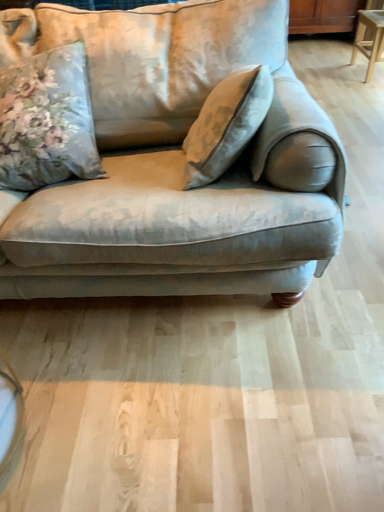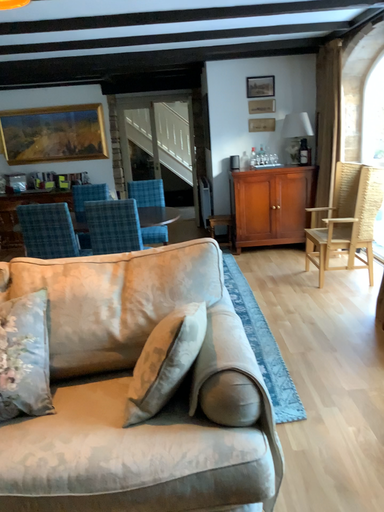
Question: Which way did the camera rotate in the video?

Choices:
 (A) rotated upward
 (B) rotated downward

Answer: (A)